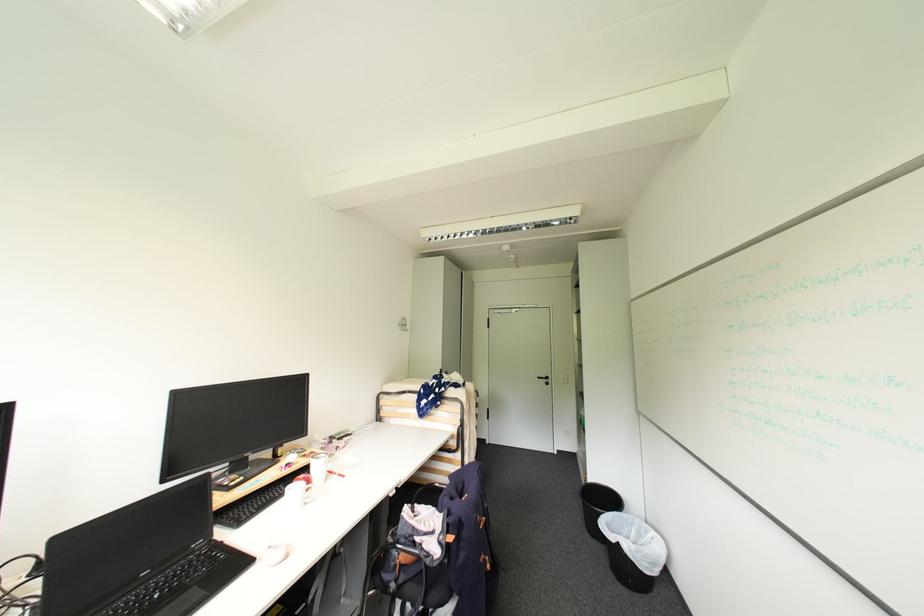
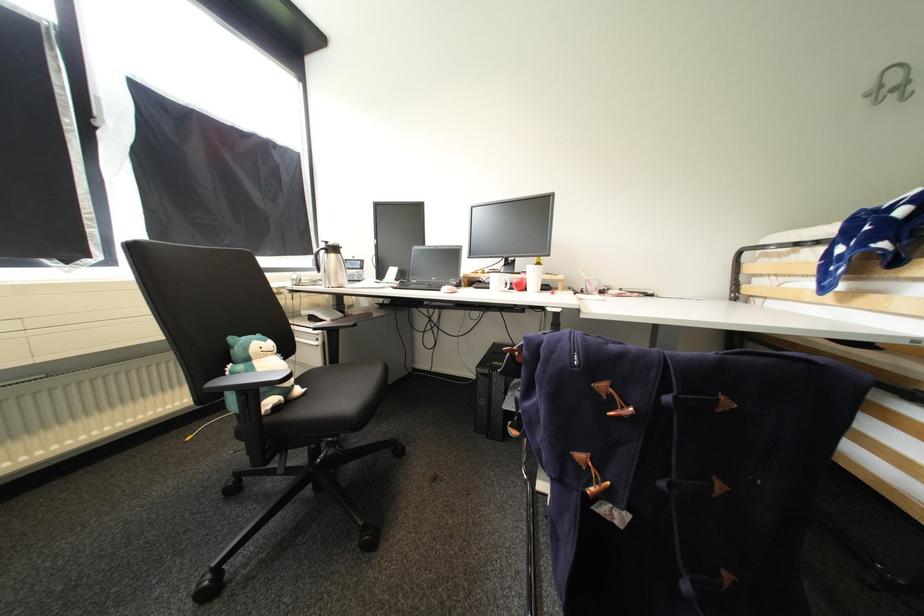
In the second image, find the point that corresponds to [411,326] in the first image.

(912, 84)